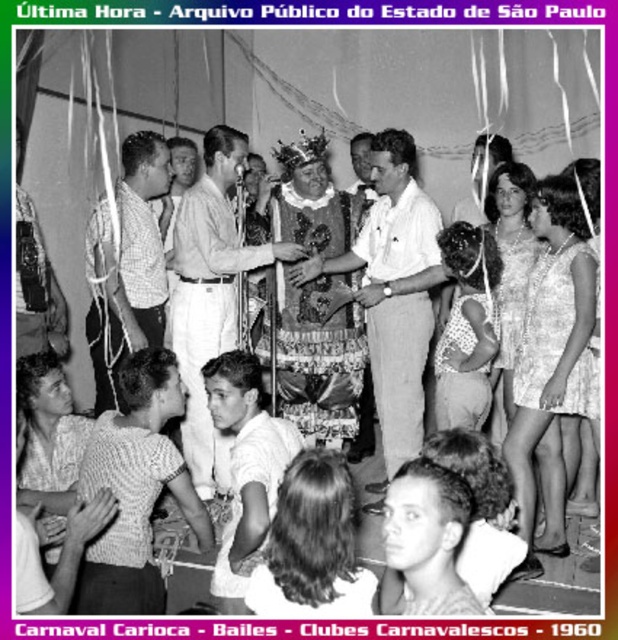
Question: Can you confirm if shiny metallic crown at center is bigger than white lace dress at center?

Choices:
 (A) yes
 (B) no

Answer: (A)

Question: Is smooth white shirt at center smaller than white lace dress at center?

Choices:
 (A) yes
 (B) no

Answer: (A)

Question: Which object is the farthest from the smooth white shirt at center?

Choices:
 (A) checkered shirt at center
 (B) light brown cotton shirt at center

Answer: (A)

Question: Is shiny metallic crown at center behind decorative fabric costume at center?

Choices:
 (A) no
 (B) yes

Answer: (B)

Question: Which of the following is the closest to the observer?

Choices:
 (A) pyautogui.click(x=192, y=285)
 (B) pyautogui.click(x=252, y=433)
 (C) pyautogui.click(x=462, y=276)
 (D) pyautogui.click(x=150, y=304)

Answer: (B)

Question: Which object is farther from the camera taking this photo?

Choices:
 (A) smooth white shirt at center
 (B) light brown cotton shirt at center
 (C) decorative fabric costume at center

Answer: (B)